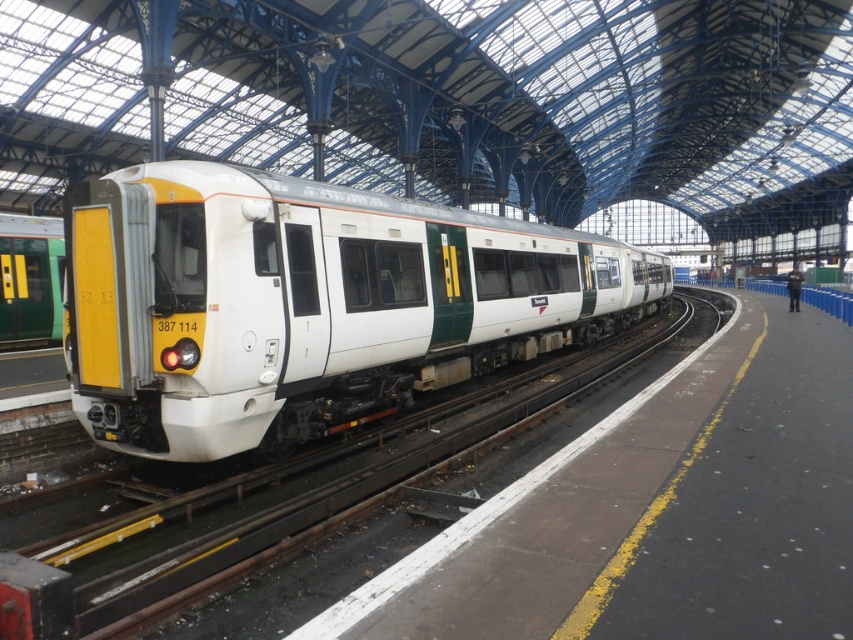
Who is more forward, (125, 284) or (57, 326)?

Point (125, 284) is in front.

Between white glossy train at center and yellow/green plastic train at left, which one is positioned lower?

Positioned lower is white glossy train at center.

Find the location of a particular element. This screenshot has height=640, width=853. white glossy train at center is located at coordinates (308, 304).

Can you confirm if white metal track at center is positioned to the left of yellow/green plastic train at left?

Incorrect, white metal track at center is not on the left side of yellow/green plastic train at left.

Is point (492, 432) in front of point (59, 252)?

That is True.

Identify the location of white metal track at center. This screenshot has width=853, height=640. (280, 520).

Can you confirm if white glossy train at center is taller than white metal track at center?

Indeed, white glossy train at center has a greater height compared to white metal track at center.

Which is below, white glossy train at center or white metal track at center?

white metal track at center

This screenshot has height=640, width=853. Describe the element at coordinates (308, 304) in the screenshot. I see `white glossy train at center` at that location.

You are a GUI agent. You are given a task and a screenshot of the screen. Output one action in this format:
    pyautogui.click(x=<x>, y=<y>)
    Task: Click on the white glossy train at center
    The image size is (853, 640).
    Given the screenshot: What is the action you would take?
    pyautogui.click(x=308, y=304)